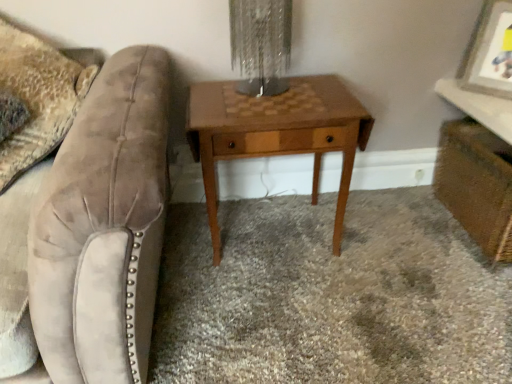
This screenshot has height=384, width=512. In order to click on free location in front of woodenmaterial/texturenightstand at center in this screenshot , I will do `click(282, 319)`.